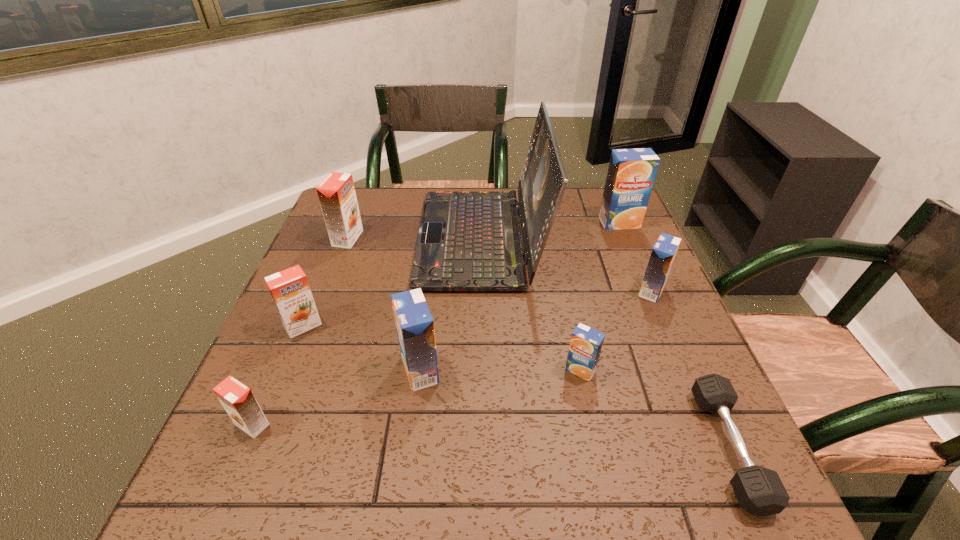
Locate an element on the screen. The width and height of the screenshot is (960, 540). blue orange_juice that can be found as the second closest to the second farthest blue orange_juice is located at coordinates (586, 343).

I want to click on blue orange_juice that stands as the third closest to the leftmost blue orange_juice, so click(631, 173).

Identify which orange orange juice is the third nearest to the fourth orange juice from right to left. Please provide its 2D coordinates. Your answer should be formatted as a tuple, i.e. [(x, y)], where the tuple contains the x and y coordinates of a point satisfying the conditions above.

[(337, 196)]

Locate which orange orange juice ranks in proximity to the farthest orange orange juice. Please provide its 2D coordinates. Your answer should be formatted as a tuple, i.e. [(x, y)], where the tuple contains the x and y coordinates of a point satisfying the conditions above.

[(290, 291)]

Identify the location of free space that satisfies the following two spatial constraints: 1. on the front side of the shortest object; 2. on the left side of the biggest orange orange juice. Image resolution: width=960 pixels, height=540 pixels. (268, 447).

Where is `vacant area in the image that satisfies the following two spatial constraints: 1. on the front side of the biggest orange orange juice; 2. on the left side of the fourth orange juice from left to right`? The height and width of the screenshot is (540, 960). vacant area in the image that satisfies the following two spatial constraints: 1. on the front side of the biggest orange orange juice; 2. on the left side of the fourth orange juice from left to right is located at coordinates (298, 370).

Identify the location of free spot that satisfies the following two spatial constraints: 1. on the screen of the tallest object; 2. on the back side of the shortest object. (482, 447).

Where is `vacant area in the image that satisfies the following two spatial constraints: 1. on the screen of the tallest object; 2. on the back side of the second farthest blue orange_juice`? vacant area in the image that satisfies the following two spatial constraints: 1. on the screen of the tallest object; 2. on the back side of the second farthest blue orange_juice is located at coordinates (481, 291).

Locate an element on the screen. The height and width of the screenshot is (540, 960). free spot that satisfies the following two spatial constraints: 1. on the screen of the tallest object; 2. on the left side of the third farthest orange juice is located at coordinates (481, 291).

Where is `vacant space that satisfies the following two spatial constraints: 1. on the back side of the nearest orange orange juice; 2. on the right side of the third biggest blue orange_juice`? The width and height of the screenshot is (960, 540). vacant space that satisfies the following two spatial constraints: 1. on the back side of the nearest orange orange juice; 2. on the right side of the third biggest blue orange_juice is located at coordinates (309, 291).